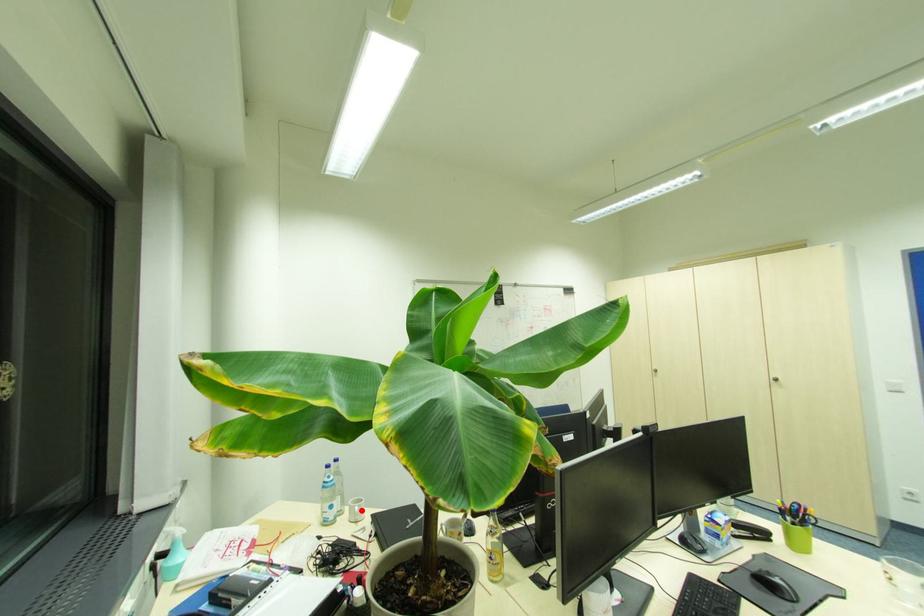
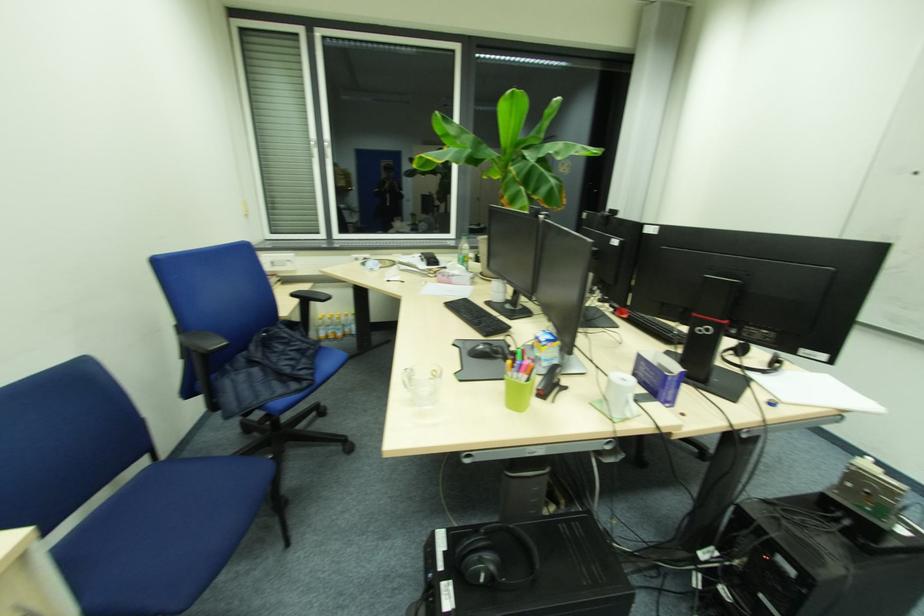
Question: I am providing you with two images of the same scene from different viewpoints. A red point is marked on the first image. Is the red point's position out of view in image 2?

Choices:
 (A) Yes
 (B) No

Answer: (A)